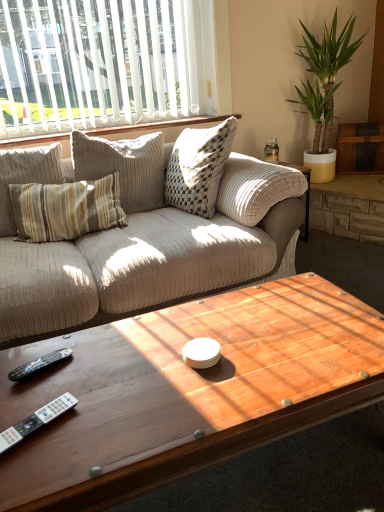
Find the location of a particular element. The image size is (384, 512). vacant space in front of black plastic remote at lower left is located at coordinates (37, 404).